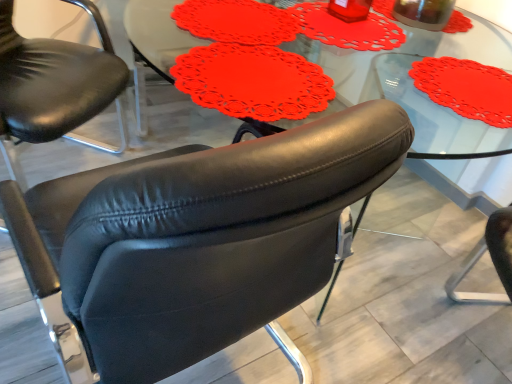
Question: Is black leather chair at center, which is the second chair in left-to-right order, located within matte red doily at center?

Choices:
 (A) no
 (B) yes

Answer: (A)

Question: Is matte red doily at center not near black leather chair at center, which ranks as the 1th chair in right-to-left order?

Choices:
 (A) no
 (B) yes

Answer: (B)

Question: Does matte red doily at center have a smaller size compared to black leather chair at center, which is the second chair in left-to-right order?

Choices:
 (A) no
 (B) yes

Answer: (B)

Question: Can you confirm if matte red doily at center is taller than black leather chair at center, which is the second chair in left-to-right order?

Choices:
 (A) yes
 (B) no

Answer: (B)

Question: Is matte red doily at center to the left of black leather chair at center, which is the second chair in left-to-right order, from the viewer's perspective?

Choices:
 (A) no
 (B) yes

Answer: (B)

Question: Is matte black armchair at center, which is the second chair from right to left, situated inside transparent glass beverage at upper right or outside?

Choices:
 (A) inside
 (B) outside

Answer: (B)

Question: From a real-world perspective, is matte black armchair at center, acting as the first chair starting from the left, physically located above or below transparent glass beverage at upper right?

Choices:
 (A) above
 (B) below

Answer: (B)

Question: In terms of height, does matte black armchair at center, acting as the first chair starting from the left, look taller or shorter compared to transparent glass beverage at upper right?

Choices:
 (A) short
 (B) tall

Answer: (B)

Question: Considering the positions of point (74, 51) and point (439, 14), is point (74, 51) closer or farther from the camera than point (439, 14)?

Choices:
 (A) closer
 (B) farther

Answer: (B)

Question: From a real-world perspective, is transparent glass beverage at upper right above or below black leather chair at center, which is the second chair in left-to-right order?

Choices:
 (A) below
 (B) above

Answer: (B)

Question: Is transparent glass beverage at upper right inside or outside of black leather chair at center, which is the second chair in left-to-right order?

Choices:
 (A) inside
 (B) outside

Answer: (B)

Question: Is point (429, 29) closer or farther from the camera than point (372, 127)?

Choices:
 (A) closer
 (B) farther

Answer: (B)

Question: In terms of width, does transparent glass beverage at upper right look wider or thinner when compared to black leather chair at center, which is the second chair in left-to-right order?

Choices:
 (A) thin
 (B) wide

Answer: (A)

Question: From the image's perspective, is black leather chair at center, which ranks as the 1th chair in right-to-left order, positioned above or below matte black armchair at center, which is the second chair from right to left?

Choices:
 (A) below
 (B) above

Answer: (A)

Question: Considering the positions of point (114, 170) and point (96, 105), is point (114, 170) closer or farther from the camera than point (96, 105)?

Choices:
 (A) closer
 (B) farther

Answer: (B)